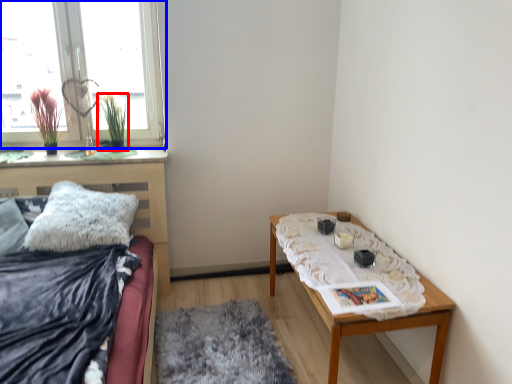
Question: Which object appears closest to the camera in this image, plant (highlighted by a red box) or window (highlighted by a blue box)?

Choices:
 (A) plant
 (B) window

Answer: (B)